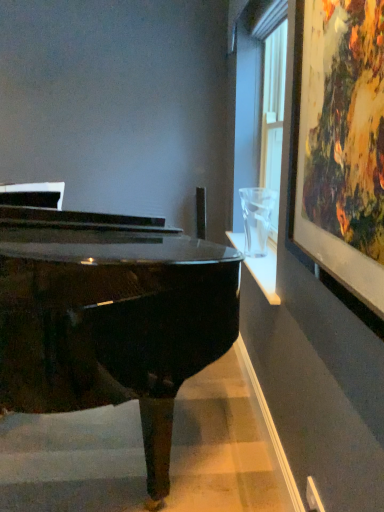
Question: Based on their sizes in the image, would you say wooden framed artwork at upper right is bigger or smaller than glossy black piano at center?

Choices:
 (A) big
 (B) small

Answer: (B)

Question: From a real-world perspective, is wooden framed artwork at upper right above or below glossy black piano at center?

Choices:
 (A) above
 (B) below

Answer: (A)

Question: Which object is positioned closest to the white plastic power outlet at lower right?

Choices:
 (A) glossy black piano at center
 (B) wooden framed artwork at upper right

Answer: (A)

Question: Estimate the real-world distances between objects in this image. Which object is farther from the glossy black piano at center?

Choices:
 (A) white plastic power outlet at lower right
 (B) wooden framed artwork at upper right

Answer: (A)